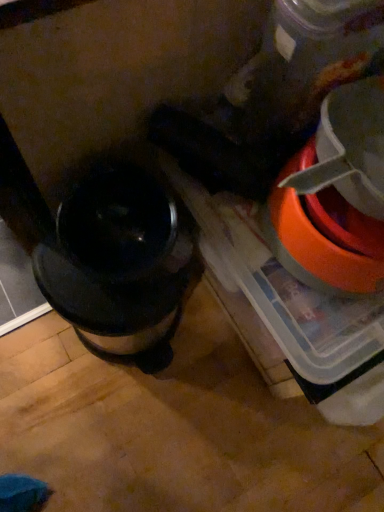
What are the coordinates of `free space that is to the left of shiny metallic coffee maker at left` in the screenshot? It's located at (31, 329).